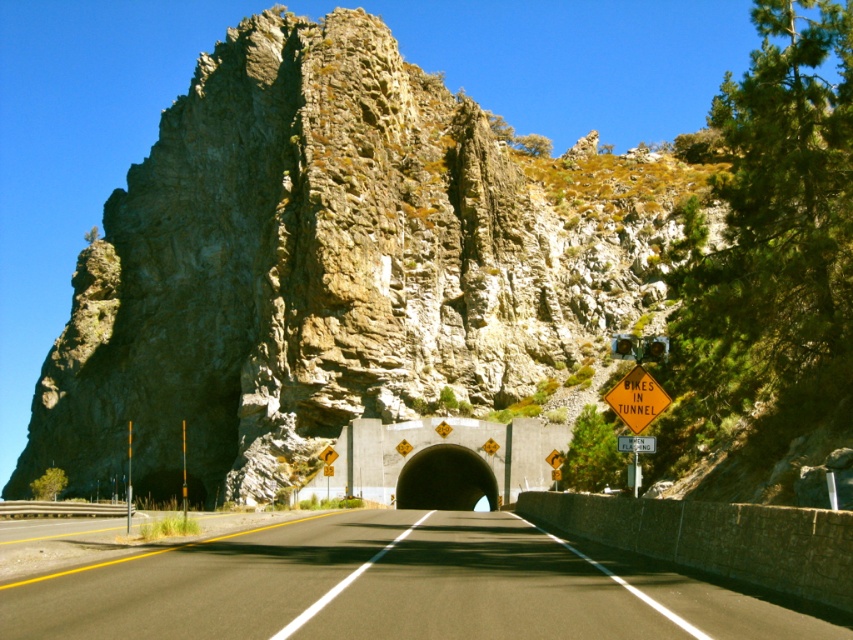
Can you confirm if black asphalt road at center is shorter than black rubber tunnel at center?

Yes, black asphalt road at center is shorter than black rubber tunnel at center.

You are a GUI agent. You are given a task and a screenshot of the screen. Output one action in this format:
    pyautogui.click(x=<x>, y=<y>)
    Task: Click on the black asphalt road at center
    The height and width of the screenshot is (640, 853).
    Given the screenshot: What is the action you would take?
    pyautogui.click(x=399, y=588)

Find the location of a particular element. This screenshot has width=853, height=640. black asphalt road at center is located at coordinates 399,588.

Can you confirm if rocky cliff at center is positioned below black asphalt road at center?

No.

Based on the photo, who is positioned more to the left, rocky cliff at center or black asphalt road at center?

From the viewer's perspective, rocky cliff at center appears more on the left side.

Does point (647, 67) lie behind point (433, 529)?

Yes, point (647, 67) is farther from viewer.

Find the location of a particular element. The width and height of the screenshot is (853, 640). rocky cliff at center is located at coordinates (74, 150).

Which is more to the left, black rubber tunnel at center or orange reflective plastic sign at center?

black rubber tunnel at center

Does point (450, 486) come farther from viewer compared to point (660, 387)?

Yes, point (450, 486) is behind point (660, 387).

Is point (444, 477) less distant than point (639, 392)?

No, it is behind (639, 392).

You are a GUI agent. You are given a task and a screenshot of the screen. Output one action in this format:
    pyautogui.click(x=<x>, y=<y>)
    Task: Click on the black rubber tunnel at center
    The height and width of the screenshot is (640, 853).
    Given the screenshot: What is the action you would take?
    pyautogui.click(x=445, y=480)